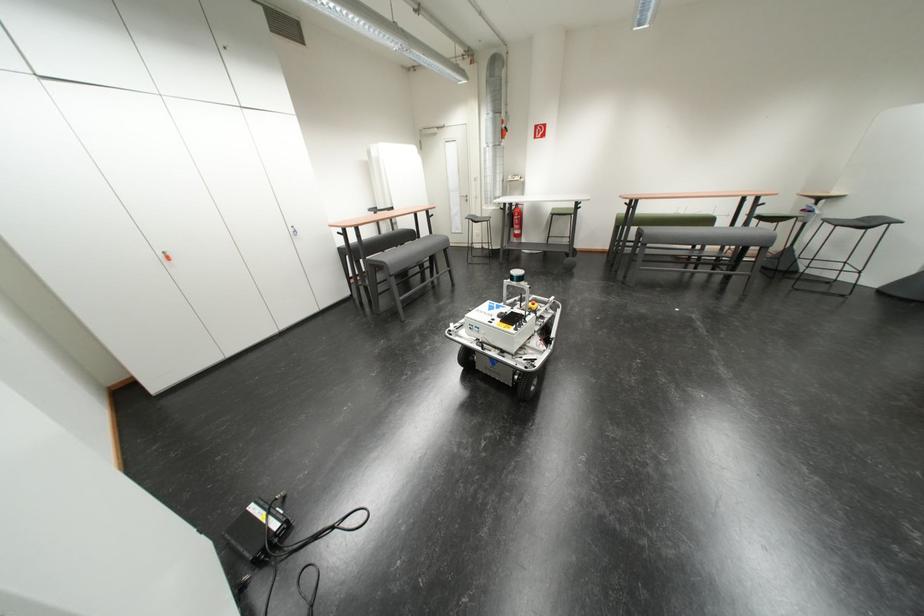
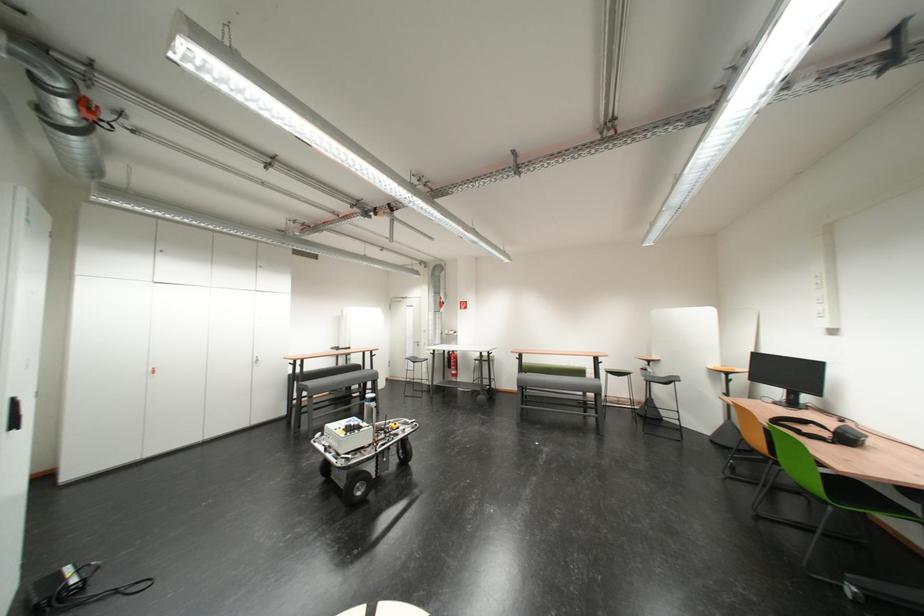
Find the pixel in the second image that matches (423,237) in the first image.

(369, 371)